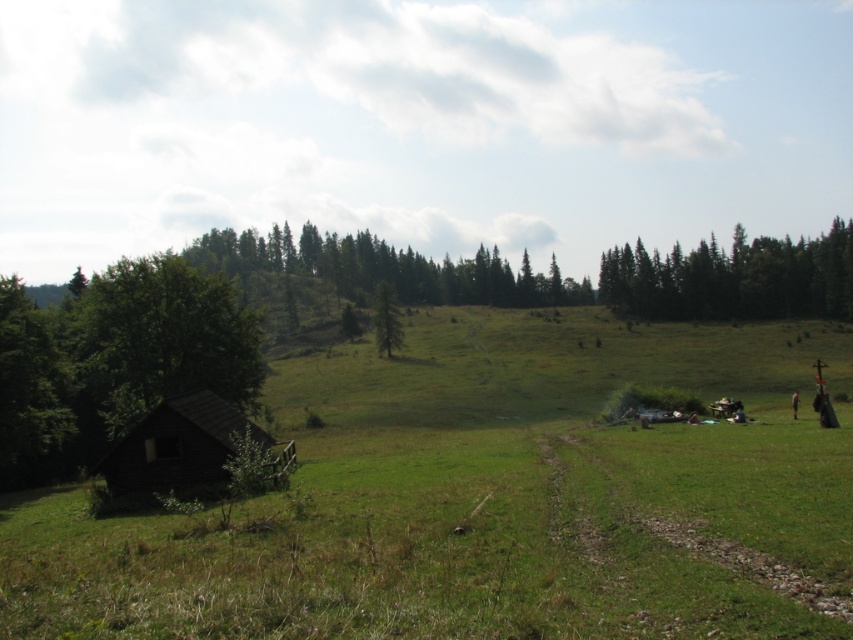
Question: Estimate the real-world distances between objects in this image. Which object is closer to the green coniferous trees at center?

Choices:
 (A) brown wooden hut at lower left
 (B) green matte tree at center
 (C) green coniferous trees at upper right

Answer: (B)

Question: Which point is closer to the camera taking this photo?

Choices:
 (A) (834, 252)
 (B) (376, 323)

Answer: (B)

Question: Is green leafy tree at left bigger than brown wooden hut at lower left?

Choices:
 (A) no
 (B) yes

Answer: (B)

Question: Is green leafy tree at left to the right of green coniferous trees at upper right from the viewer's perspective?

Choices:
 (A) no
 (B) yes

Answer: (A)

Question: Can you confirm if green coniferous trees at upper right is wider than green matte tree at center?

Choices:
 (A) yes
 (B) no

Answer: (A)

Question: Among these points, which one is nearest to the camera?

Choices:
 (A) click(x=386, y=292)
 (B) click(x=225, y=353)
 (C) click(x=641, y=243)
 (D) click(x=125, y=444)

Answer: (D)